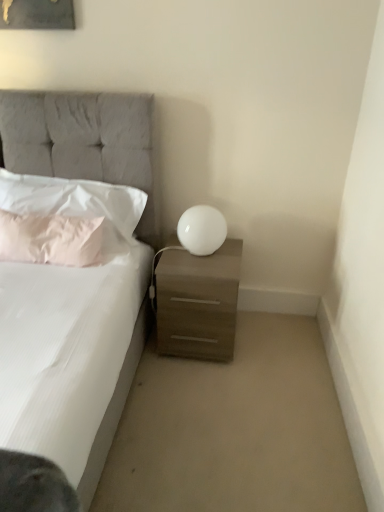
You are a GUI agent. You are given a task and a screenshot of the screen. Output one action in this format:
    pyautogui.click(x=<x>, y=<y>)
    Task: Click on the unoccupied region to the right of matte wood nightstand at lower right
    This screenshot has height=512, width=384.
    Given the screenshot: What is the action you would take?
    pyautogui.click(x=266, y=345)